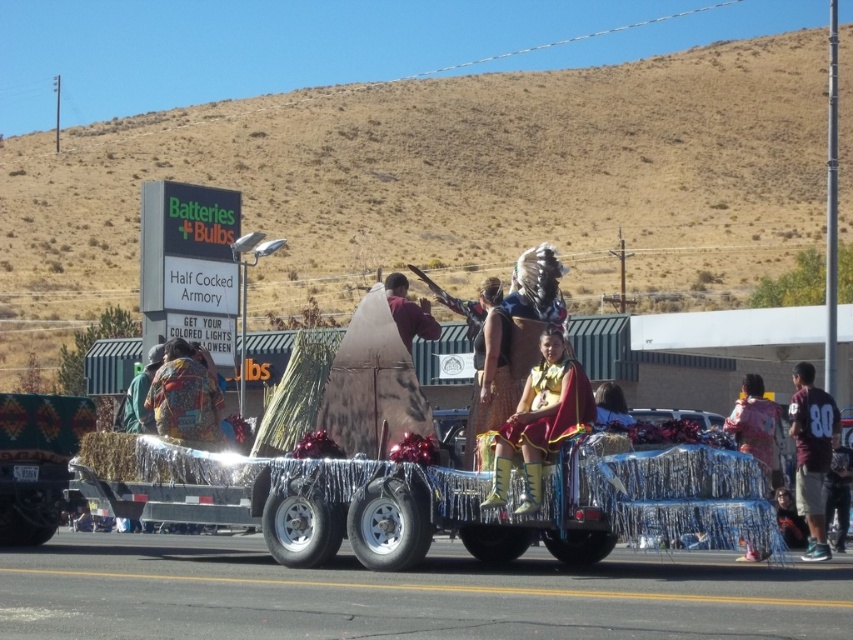
You are a photographer at the parade event. You want to capture a photo that includes both the yellow leather boots at center and the pink fabric at center. Which object should be placed to the left in the frame?

The yellow leather boots at center should be placed to the left of the pink fabric at center in the frame since the yellow leather boots at center is positioned on the left side of pink fabric at center.

You are a photographer trying to capture the shiny metallic cart at center and the textured fabric outfit at left in the same frame. Since you want both to be clearly visible, which object should you adjust your camera focus towards to ensure the thinner one is in focus?

The shiny metallic cart at center is thinner than the textured fabric outfit at left. To ensure the thinner object is in focus, you should adjust your camera focus towards the shiny metallic cart at center.